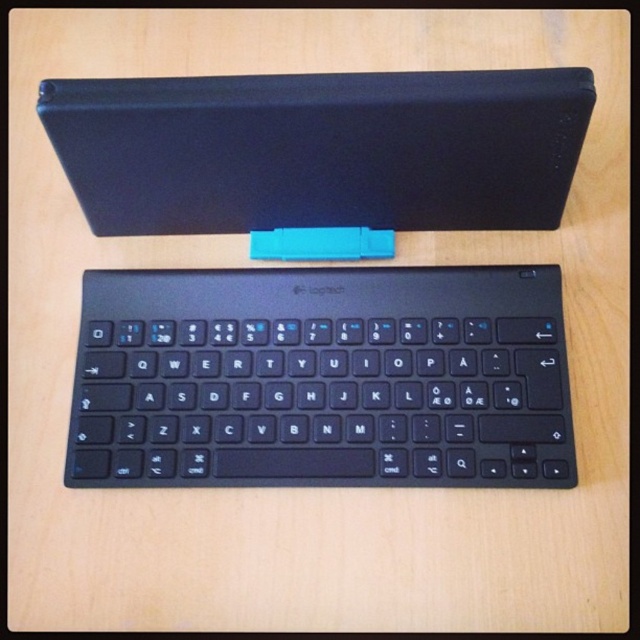
Describe the element at coordinates (321, 378) in the screenshot. This screenshot has height=640, width=640. I see `black matte keyboard at center` at that location.

You are a GUI agent. You are given a task and a screenshot of the screen. Output one action in this format:
    pyautogui.click(x=<x>, y=<y>)
    Task: Click on the black matte keyboard at center
    
    Given the screenshot: What is the action you would take?
    pyautogui.click(x=321, y=378)